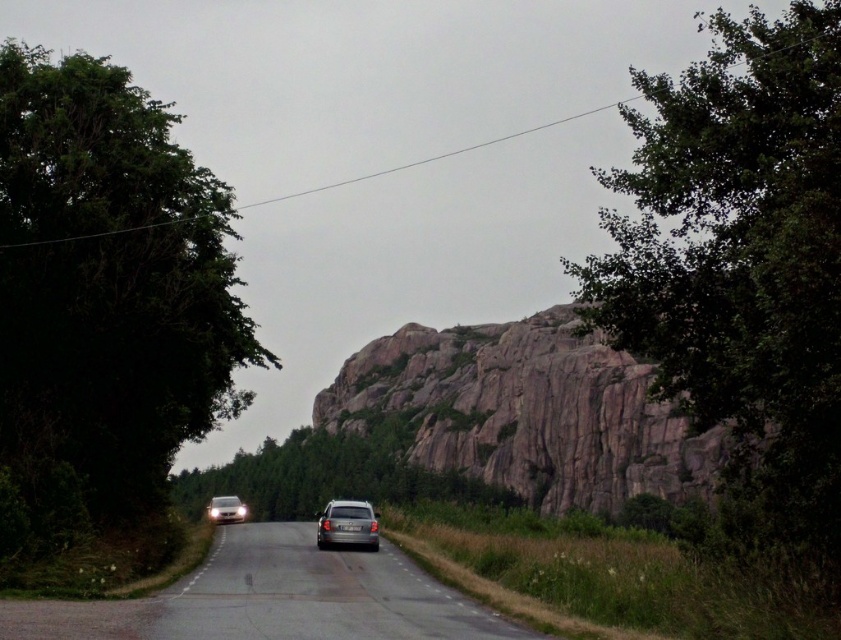
Question: Can you confirm if rusty granite mountain at center is smaller than satin silver car at center?

Choices:
 (A) no
 (B) yes

Answer: (A)

Question: Based on their relative distances, which object is nearer to the green leafy tree at left?

Choices:
 (A) satin silver car at center
 (B) white matte car at lower left
 (C) green leafy tree at center
 (D) green leafy tree at upper right

Answer: (A)

Question: Among these points, which one is nearest to the camera?

Choices:
 (A) 625,296
 (B) 210,321

Answer: (A)

Question: Considering the real-world distances, which object is farthest from the green leafy tree at center?

Choices:
 (A) green leafy tree at upper right
 (B) satin silver car at center
 (C) green leafy tree at left

Answer: (A)

Question: Does green leafy tree at upper right appear on the right side of green leafy tree at center?

Choices:
 (A) yes
 (B) no

Answer: (A)

Question: Is green leafy tree at upper right closer to camera compared to silver metallic car at center?

Choices:
 (A) yes
 (B) no

Answer: (A)